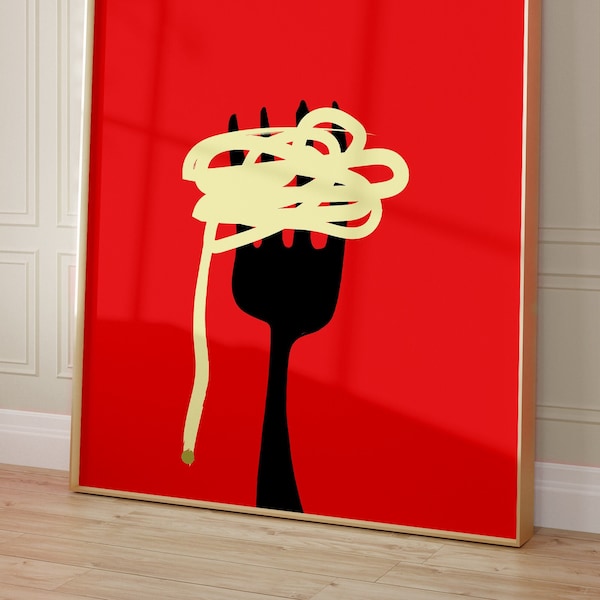
In order to click on wall in this screenshot , I will do `click(43, 190)`, `click(570, 177)`.